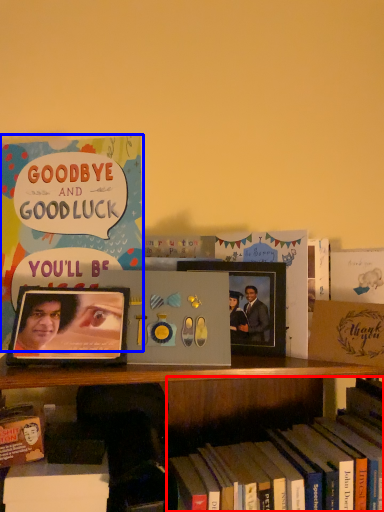
Question: Which point is closer to the camera, book (highlighted by a red box) or book (highlighted by a blue box)?

Choices:
 (A) book
 (B) book

Answer: (A)